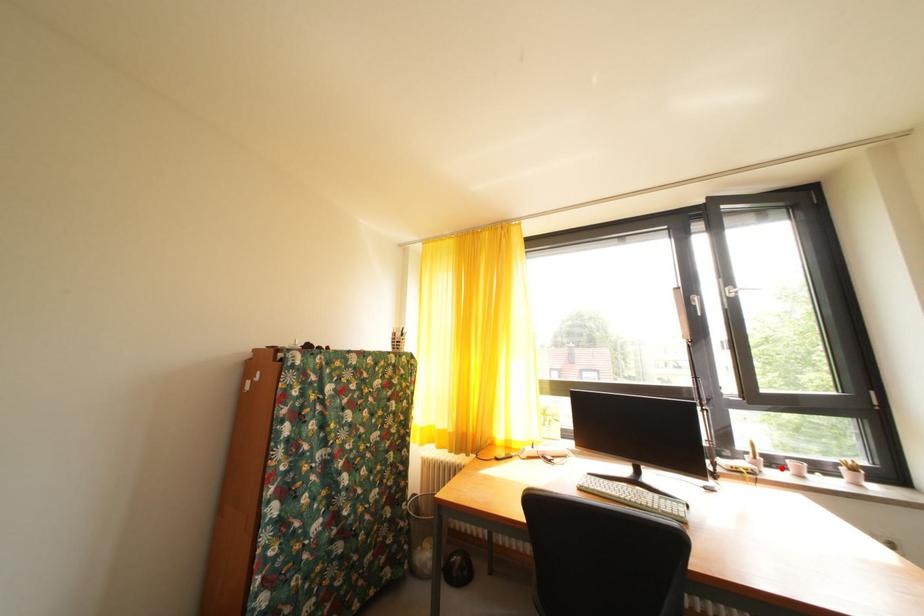
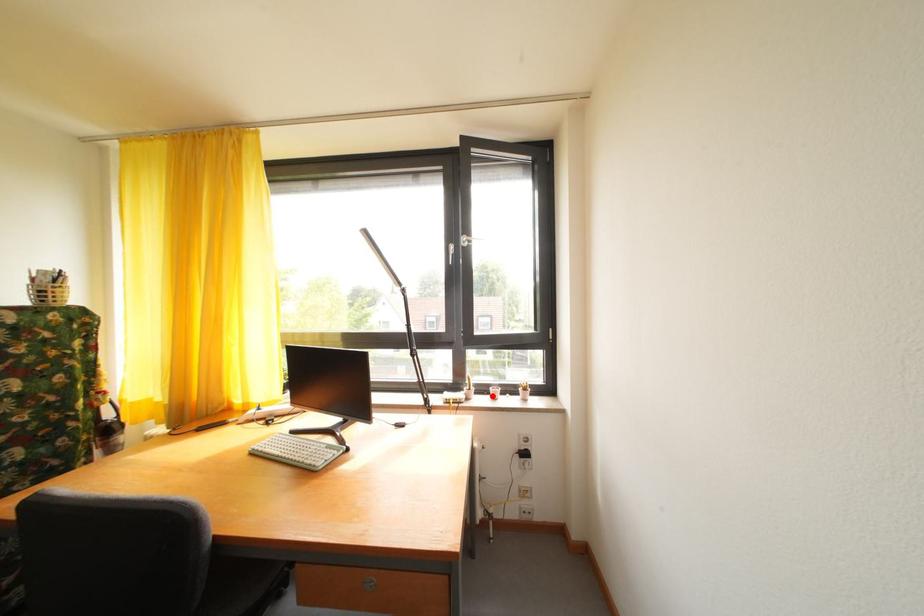
I am providing you with two images of the same scene from different viewpoints. A red point is marked on the first image and another point is marked on the second image. Does the point marked in image1 correspond to the same location as the one in image2?

Yes